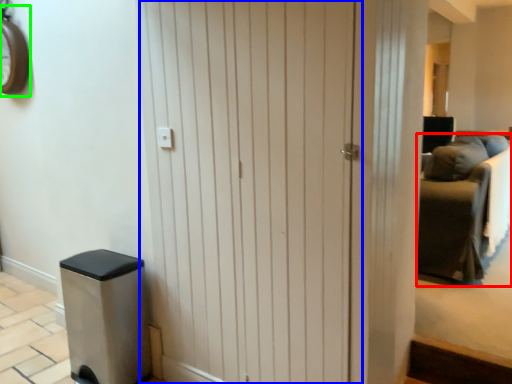
Question: Which is nearer to the furniture (highlighted by a red box)? barn door (highlighted by a blue box) or clock (highlighted by a green box).

Choices:
 (A) barn door
 (B) clock

Answer: (A)